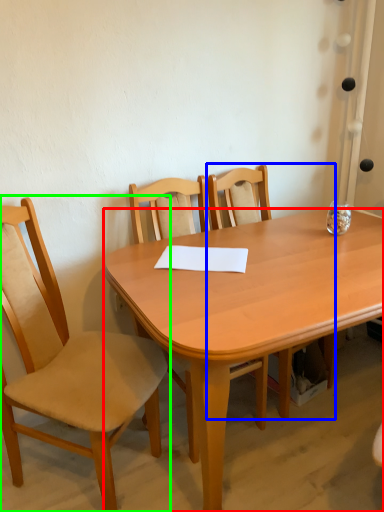
Question: Which is farther away from desk (highlighted by a red box)? chair (highlighted by a blue box) or chair (highlighted by a green box)?

Choices:
 (A) chair
 (B) chair

Answer: (A)